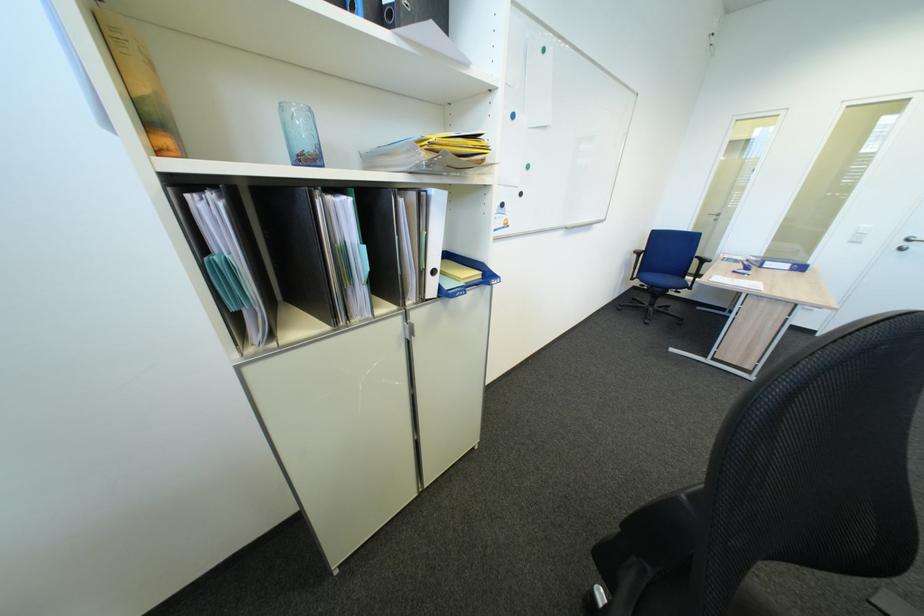
The height and width of the screenshot is (616, 924). What do you see at coordinates (743, 268) in the screenshot?
I see `the blue stapler` at bounding box center [743, 268].